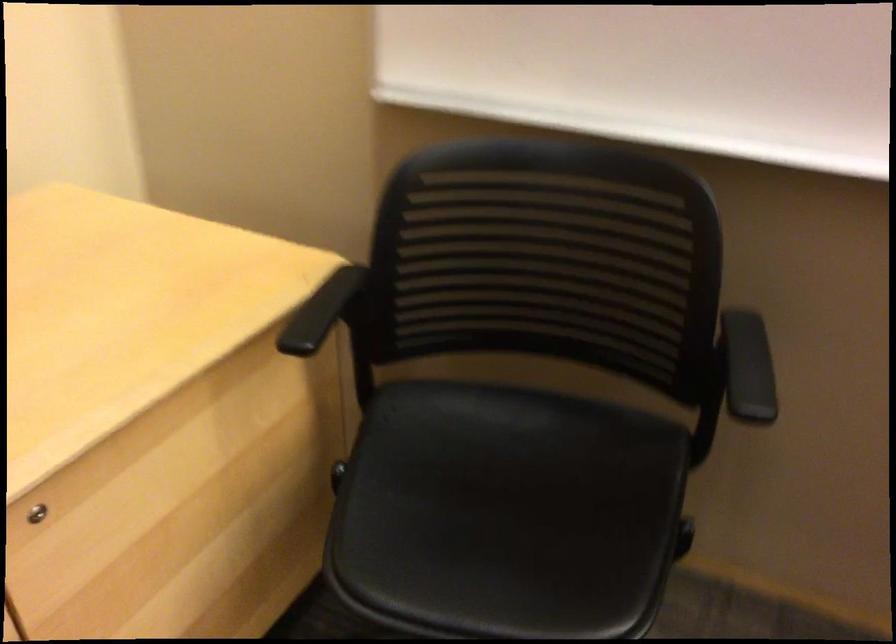
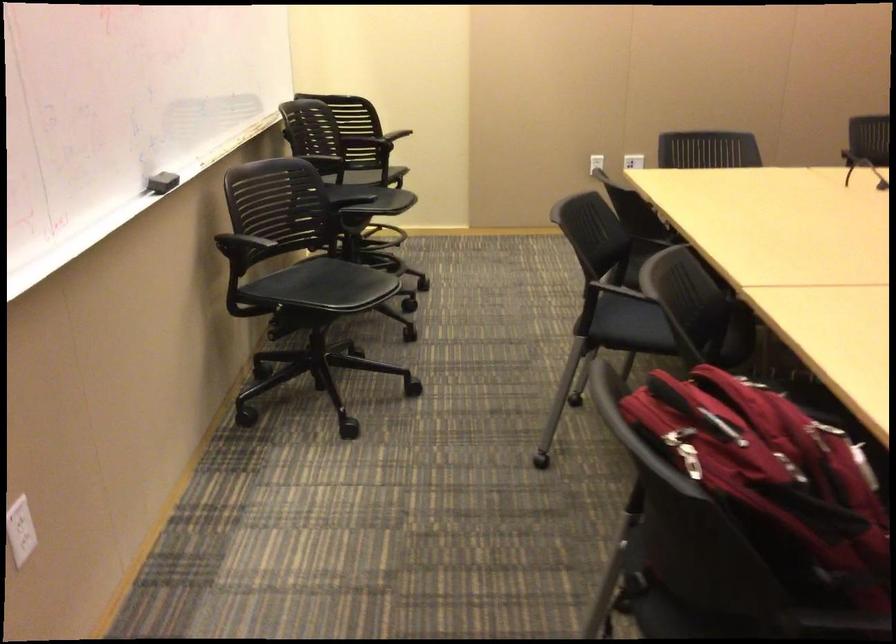
How did the camera likely rotate?

The rotation direction of the camera is right-down.